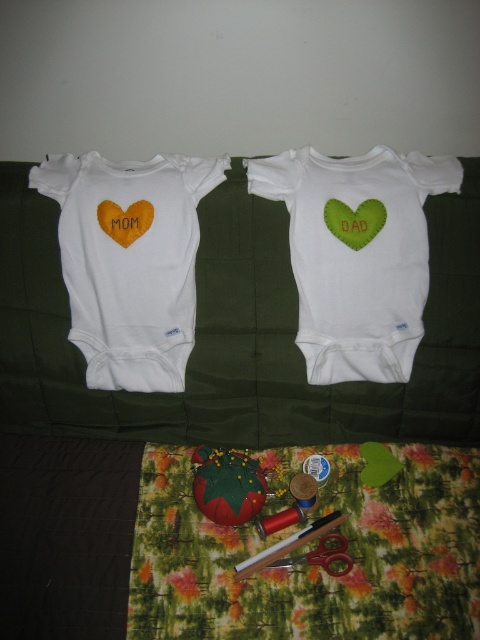
Which of these two, white felt heart at center or matte orange heart at upper left, stands taller?

Standing taller between the two is white felt heart at center.

Locate an element on the screen. white felt heart at center is located at coordinates click(357, 253).

Does point (345, 180) come closer to viewer compared to point (310, 556)?

No.

The height and width of the screenshot is (640, 480). Find the location of `white felt heart at center`. white felt heart at center is located at coordinates (357, 253).

Identify the location of white felt heart at center. (357, 253).

Is matte white onesie at left in front of matte orange heart at upper left?

That is True.

Between matte white onesie at left and matte orange heart at upper left, which one appears on the right side from the viewer's perspective?

matte orange heart at upper left is more to the right.

Is point (144, 376) positioned behind point (120, 208)?

Yes.

Locate an element on the screen. The image size is (480, 640). matte white onesie at left is located at coordinates (130, 260).